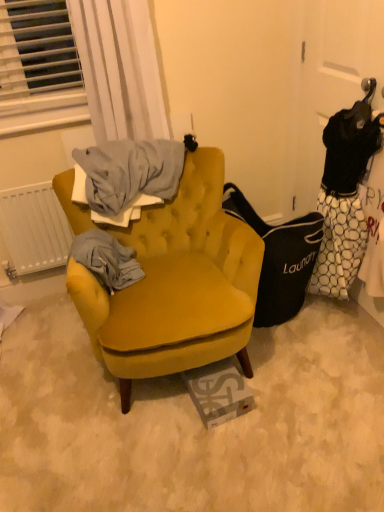
The image size is (384, 512). Describe the element at coordinates (34, 228) in the screenshot. I see `white matte radiator at left` at that location.

Identify the location of black fabric laundry bag at right. (280, 259).

In the scene shown: Does white sheer curtain at upper left have a greater width compared to black fabric laundry bag at right?

No.

Is white sheer curtain at upper left far away from black fabric laundry bag at right?

That's not correct — white sheer curtain at upper left is a little close to black fabric laundry bag at right.

From the image's perspective, does white sheer curtain at upper left appear higher than black fabric laundry bag at right?

Indeed, from the image's perspective, white sheer curtain at upper left is shown above black fabric laundry bag at right.

Which point is more forward, [79,42] or [291,242]?

The point [79,42] is more forward.

Which is closer to the camera, (11, 207) or (266, 225)?

Clearly, point (11, 207) is closer to the camera than point (266, 225).

From a real-world perspective, between white matte radiator at left and black fabric laundry bag at right, who is vertically higher?

In real-world perspective, white matte radiator at left is above.

You are a GUI agent. You are given a task and a screenshot of the screen. Output one action in this format:
    pyautogui.click(x=<x>, y=<y>)
    Task: Click on the handbag in front of the white matte radiator at left
    
    Given the screenshot: What is the action you would take?
    pyautogui.click(x=280, y=259)

Is white matte radiator at left facing away from black fabric laundry bag at right?

No, white matte radiator at left is not facing away from black fabric laundry bag at right.

Can you tell me how much black fabric laundry bag at right and white dotted fabric at right differ in facing direction?

86.2 degrees separate the facing orientations of black fabric laundry bag at right and white dotted fabric at right.

From the image's perspective, is black fabric laundry bag at right above or below white dotted fabric at right?

Based on their image positions, black fabric laundry bag at right is located beneath white dotted fabric at right.

Considering the positions of points (259, 225) and (308, 199), is point (259, 225) closer to camera compared to point (308, 199)?

Yes, it is.

I want to click on door below the white sheer curtain at upper left (from the image's perspective), so click(333, 78).

From the image's perspective, who appears lower, white dotted fabric at right or white sheer curtain at upper left?

white dotted fabric at right.

Can you confirm if white dotted fabric at right is wider than white sheer curtain at upper left?

No.

From a real-world perspective, who is located lower, white dotted fabric at right or white sheer curtain at upper left?

In real-world perspective, white dotted fabric at right is lower.

Between white sheer curtain at upper left and white dotted fabric at right, which one appears on the left side from the viewer's perspective?

white sheer curtain at upper left is more to the left.

From the image's perspective, is white sheer curtain at upper left below white dotted fabric at right?

No.

Between white sheer curtain at upper left and white dotted fabric at right, which one is positioned in front?

white dotted fabric at right is more forward.

From a real-world perspective, is white sheer curtain at upper left below white dotted fabric at right?

Actually, white sheer curtain at upper left is physically above white dotted fabric at right in the real world.

Between white matte radiator at left and white sheer curtain at upper left, which one has more height?

Standing taller between the two is white sheer curtain at upper left.

From the image's perspective, is white matte radiator at left located beneath white sheer curtain at upper left?

Yes.

Can you confirm if white matte radiator at left is smaller than white sheer curtain at upper left?

Indeed, white matte radiator at left has a smaller size compared to white sheer curtain at upper left.

Are white matte radiator at left and white sheer curtain at upper left far apart?

No, white matte radiator at left is in close proximity to white sheer curtain at upper left.

Is velvet mustard armchair at center at the right side of black fabric laundry bag at right?

Incorrect, velvet mustard armchair at center is not on the right side of black fabric laundry bag at right.

Considering the positions of objects velvet mustard armchair at center and black fabric laundry bag at right in the image provided, who is in front, velvet mustard armchair at center or black fabric laundry bag at right?

velvet mustard armchair at center is more forward.

Which of these two, velvet mustard armchair at center or black fabric laundry bag at right, is thinner?

Thinner between the two is black fabric laundry bag at right.

At what (x,y) coordinates should I click in order to perform the action: click on curtain located in front of the black fabric laundry bag at right. Please return your answer as a coordinate pair (x, y). This screenshot has width=384, height=512. Looking at the image, I should click on (119, 68).

This screenshot has width=384, height=512. What are the coordinates of `radiator above the black fabric laundry bag at right (from the image's perspective)` in the screenshot? It's located at (34, 228).

Based on their spatial positions, is black fabric laundry bag at right or white sheer curtain at upper left further from white dotted fabric at right?

white sheer curtain at upper left is positioned further to the anchor white dotted fabric at right.

From the image, which object appears to be farther from white sheer curtain at upper left, white matte radiator at left or white dotted fabric at right?

white dotted fabric at right is further to white sheer curtain at upper left.

From the image, which object appears to be farther from white sheer curtain at upper left, black fabric laundry bag at right or white dotted fabric at right?

black fabric laundry bag at right is positioned further to the anchor white sheer curtain at upper left.

Estimate the real-world distances between objects in this image. Which object is closer to white matte radiator at left, white sheer curtain at upper left or white dotted fabric at right?

white sheer curtain at upper left is closer to white matte radiator at left.

Based on their spatial positions, is white sheer curtain at upper left or black fabric laundry bag at right further from velvet mustard armchair at center?

white sheer curtain at upper left.

Considering their positions, is white sheer curtain at upper left positioned closer to black fabric laundry bag at right than white dotted fabric at right?

white dotted fabric at right is positioned closer to the anchor black fabric laundry bag at right.

Which object lies further to the anchor point velvet mustard armchair at center, white dotted fabric at right or white sheer curtain at upper left?

white dotted fabric at right is positioned further to the anchor velvet mustard armchair at center.

Based on their spatial positions, is white matte radiator at left or black fabric laundry bag at right further from velvet mustard armchair at center?

white matte radiator at left is positioned further to the anchor velvet mustard armchair at center.

This screenshot has height=512, width=384. In order to click on chair between white matte radiator at left and black fabric laundry bag at right in the horizontal direction in this screenshot , I will do `click(176, 284)`.

This screenshot has width=384, height=512. I want to click on curtain between white matte radiator at left and white dotted fabric at right, so click(119, 68).

Locate an element on the screen. This screenshot has width=384, height=512. handbag located between white sheer curtain at upper left and white dotted fabric at right in the left-right direction is located at coordinates (280, 259).

This screenshot has height=512, width=384. Find the location of `curtain located between white matte radiator at left and black fabric laundry bag at right in the left-right direction`. curtain located between white matte radiator at left and black fabric laundry bag at right in the left-right direction is located at coordinates [x=119, y=68].